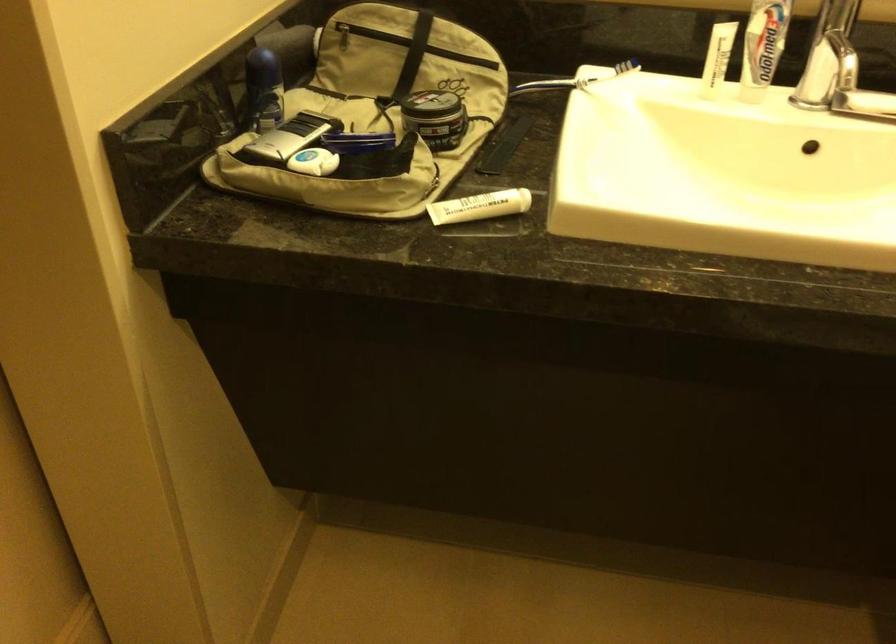
Image resolution: width=896 pixels, height=644 pixels. I want to click on faucet lever, so click(x=830, y=55).